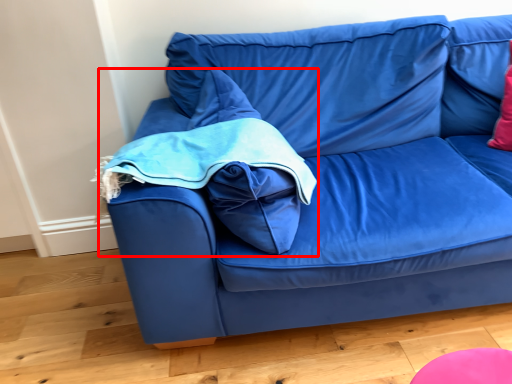
Question: Observing the image, what is the correct spatial positioning of bean bag chair (annotated by the red box) in reference to studio couch?

Choices:
 (A) left
 (B) right

Answer: (A)